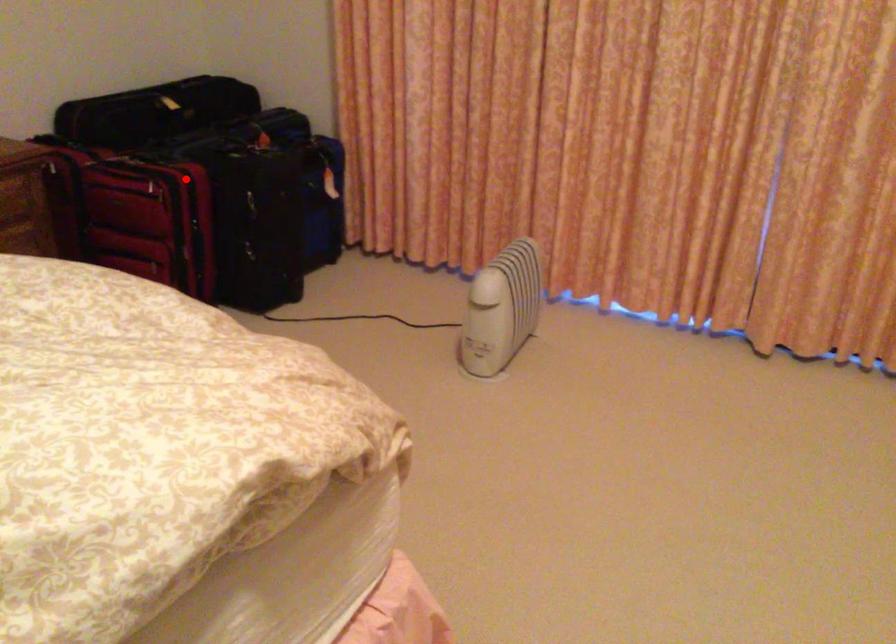
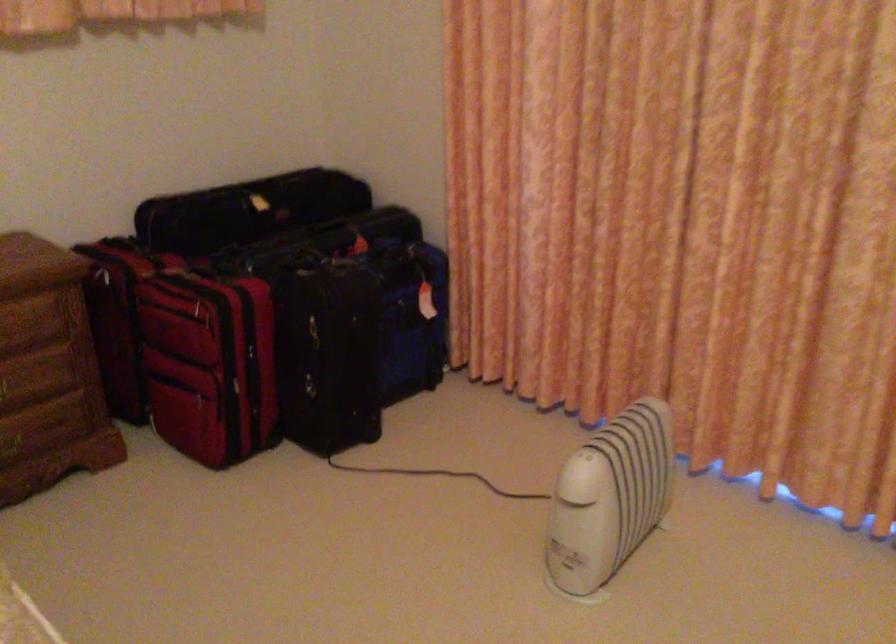
In the second image, find the point that corresponds to the highlighted location in the first image.

(243, 292)